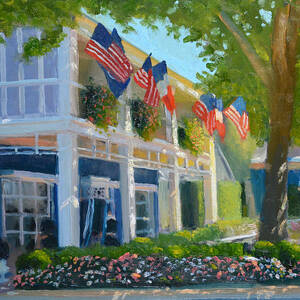
Identify the location of windows. (46, 257), (31, 102), (28, 205), (141, 207).